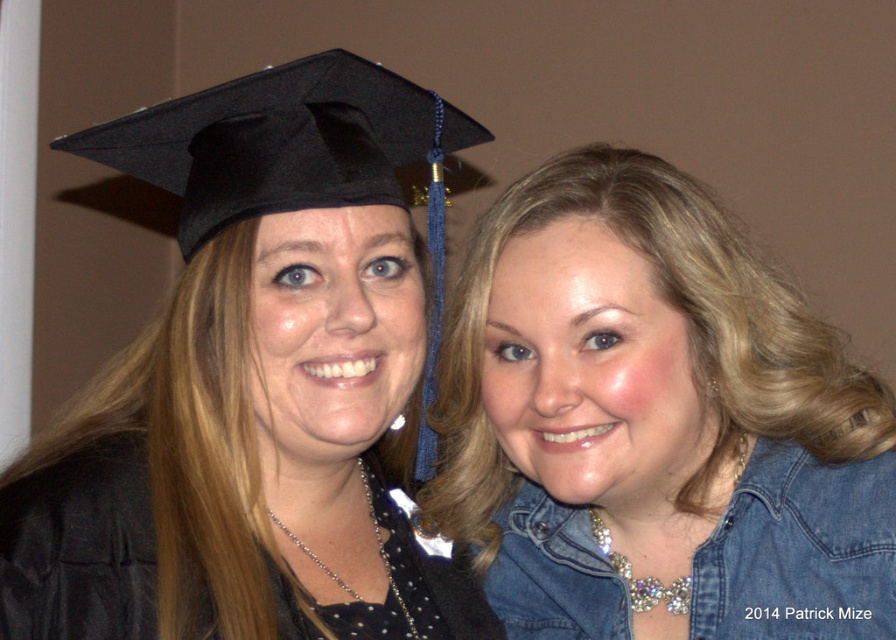
You are a photographer setting up a shot for a graduation photo. You have two subjects in front of you, one wearing a matte black graduation cap at upper left and the other wearing a denim jacket at lower right. You want to ensure that the graduation cap is visible in the frame. Given that the graduation cap is taller than the denim jacket, where should you position the camera to capture both subjects clearly?

Since the matte black graduation cap at upper left is taller than the denim jacket at lower right, positioning the camera at a slightly elevated angle will ensure both the height of the cap and the details of the denim jacket at lower right are visible in the frame.

You are taking a photo of two people. You need to place a small flower decoration between the denim jacket at lower right and the black matte graduation cap at upper left. Based on their positions, where should you place the flower so it is centered between them?

The denim jacket at lower right is to the right of the black matte graduation cap at upper left, so you should place the flower to the right of the black matte graduation cap at upper left but to the left of the denim jacket at lower right to center it between them.

Based on the photo, you are taking a photo of two people. You need to adjust the focus so that the denim jacket at lower right and the black matte graduation cap at upper left are both in focus. Which object should you focus on first to ensure both are sharp?

You should focus on the denim jacket at lower right first because it is closer to the viewer than the black matte graduation cap at upper left. By focusing on the closer object, the depth of field will extend backward, potentially keeping both in focus.